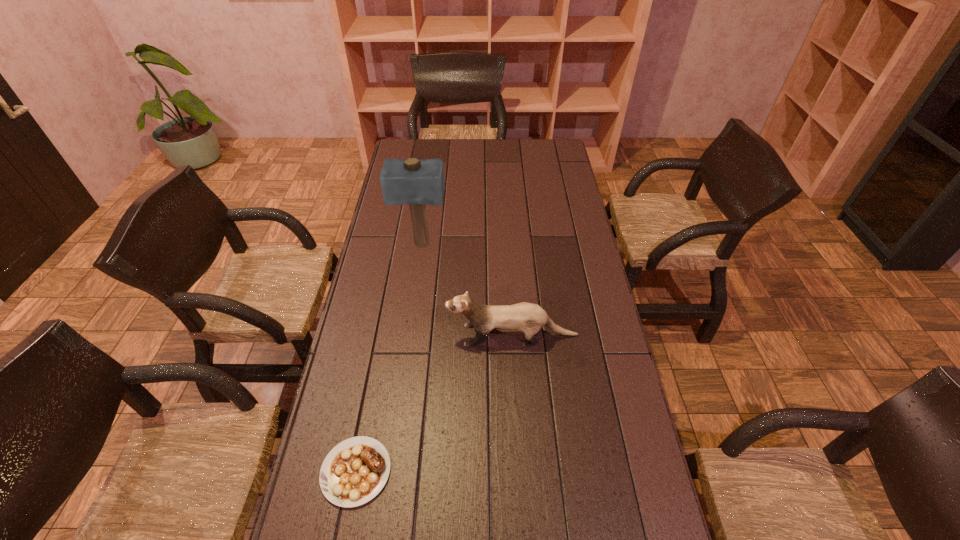
Find the location of `the tallest object`. the tallest object is located at coordinates (410, 181).

Where is `mallet`? This screenshot has width=960, height=540. mallet is located at coordinates (410, 181).

The height and width of the screenshot is (540, 960). I want to click on ferret, so click(x=529, y=318).

Image resolution: width=960 pixels, height=540 pixels. Find the location of `the second farthest object`. the second farthest object is located at coordinates (529, 318).

This screenshot has height=540, width=960. In order to click on the shortest object in this screenshot , I will do 354,471.

Where is `the nearest object`? This screenshot has width=960, height=540. the nearest object is located at coordinates (354, 471).

Where is `free point located on the back of the tallest object`? The width and height of the screenshot is (960, 540). free point located on the back of the tallest object is located at coordinates (429, 188).

This screenshot has height=540, width=960. In order to click on vacant space located 0.120m on the face of the second tallest object in this screenshot , I will do `click(408, 335)`.

Locate an element on the screen. The image size is (960, 540). free region located on the face of the second tallest object is located at coordinates (360, 335).

Locate an element on the screen. The width and height of the screenshot is (960, 540). free spot located on the face of the second tallest object is located at coordinates [x=415, y=335].